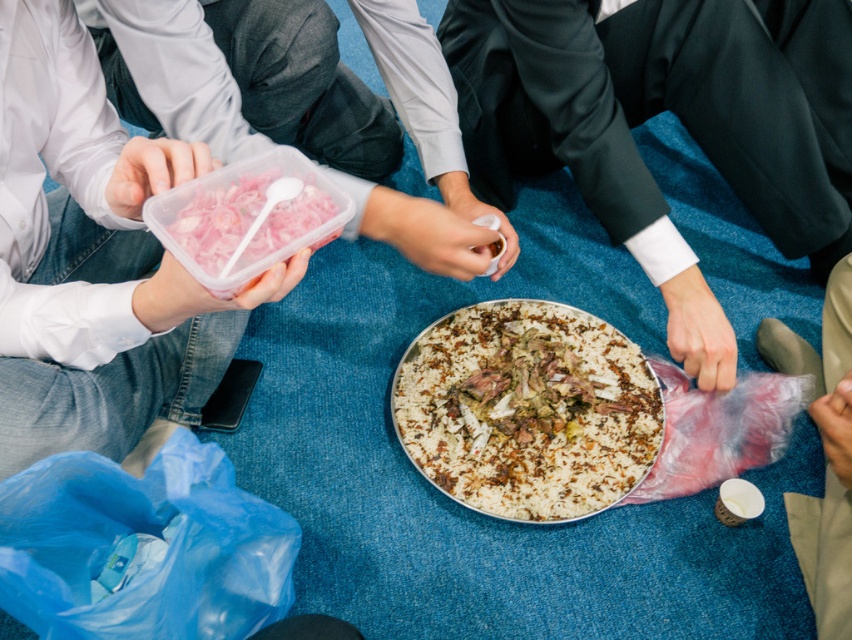
You are at a picnic and need to store some food. You have a translucent plastic container with pink shredded food at center and a clear plastic bag at lower right. Which container would be better for stacking multiple items on top of it?

The clear plastic bag at lower right is taller than the translucent plastic container with pink shredded food at center, so it would be better to use the clear plastic bag at lower right for stacking since it can support more weight without tipping over due to its height.

You are at a gathering and want to reach for the clear plastic bag at lower right without moving your chair. Can you easily access it if the translucent plastic container with pink shredded food at center is blocking your path?

The translucent plastic container with pink shredded food at center is closer to the viewer than the clear plastic bag at lower right, so it may block access to the clear plastic bag at lower right. You might need to move the container to reach the bag.